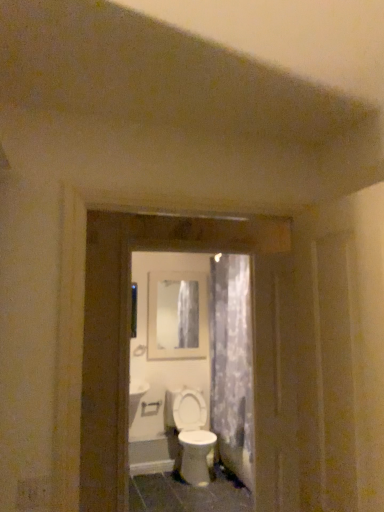
Question: From the image's perspective, is white plastic door handle at center under matte glass mirror at center?

Choices:
 (A) no
 (B) yes

Answer: (B)

Question: Is white plastic door handle at center bigger than matte glass mirror at center?

Choices:
 (A) no
 (B) yes

Answer: (A)

Question: Is white plastic door handle at center at the right side of matte glass mirror at center?

Choices:
 (A) no
 (B) yes

Answer: (A)

Question: Could matte glass mirror at center be considered to be inside white plastic door handle at center?

Choices:
 (A) yes
 (B) no

Answer: (B)

Question: Considering the relative positions of white plastic door handle at center and matte glass mirror at center in the image provided, is white plastic door handle at center in front of matte glass mirror at center?

Choices:
 (A) yes
 (B) no

Answer: (A)

Question: Is matte glass mirror at center in front of or behind white plastic door handle at center in the image?

Choices:
 (A) front
 (B) behind

Answer: (B)

Question: Is matte glass mirror at center spatially inside white plastic door handle at center, or outside of it?

Choices:
 (A) inside
 (B) outside

Answer: (B)

Question: Would you say matte glass mirror at center is to the left or to the right of white plastic door handle at center in the picture?

Choices:
 (A) left
 (B) right

Answer: (B)

Question: In terms of width, does matte glass mirror at center look wider or thinner when compared to white plastic door handle at center?

Choices:
 (A) thin
 (B) wide

Answer: (A)

Question: Is white plastic door handle at center to the left or to the right of white glossy screen door at center in the image?

Choices:
 (A) left
 (B) right

Answer: (A)

Question: Which is correct: white plastic door handle at center is inside white glossy screen door at center, or outside of it?

Choices:
 (A) outside
 (B) inside

Answer: (A)

Question: Considering their positions, is white plastic door handle at center located in front of or behind white glossy screen door at center?

Choices:
 (A) front
 (B) behind

Answer: (B)

Question: Is white plastic door handle at center wider or thinner than white glossy screen door at center?

Choices:
 (A) wide
 (B) thin

Answer: (B)

Question: From the image's perspective, is white glossy screen door at center located above or below white plastic door handle at center?

Choices:
 (A) below
 (B) above

Answer: (B)

Question: From their relative heights in the image, would you say white glossy screen door at center is taller or shorter than white plastic door handle at center?

Choices:
 (A) short
 (B) tall

Answer: (B)